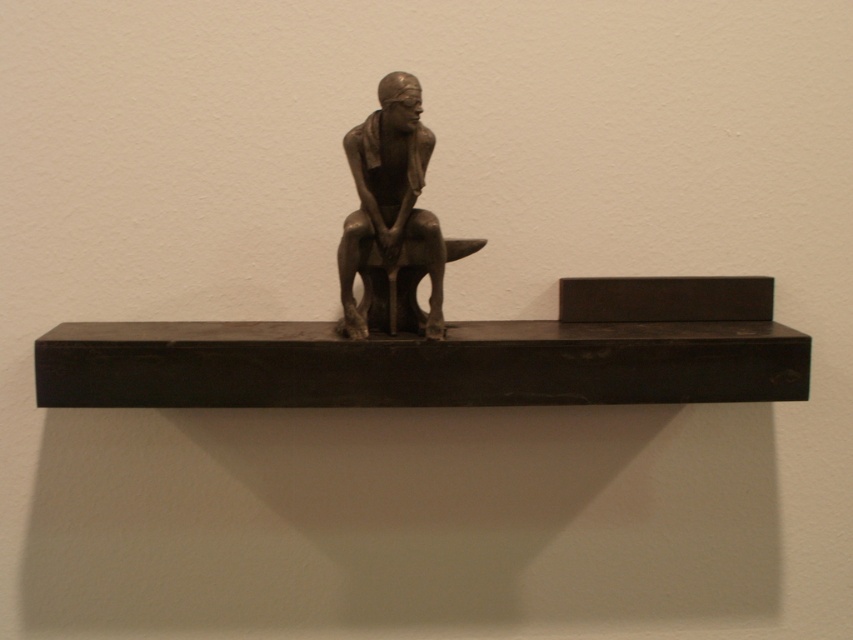
Can you confirm if black wood shelf at center is positioned below bronze statue at center?

Indeed, black wood shelf at center is positioned under bronze statue at center.

Can you confirm if black wood shelf at center is smaller than bronze statue at center?

Actually, black wood shelf at center might be larger than bronze statue at center.

Is point (267, 362) less distant than point (384, 172)?

Yes, it is.

Image resolution: width=853 pixels, height=640 pixels. Find the location of `black wood shelf at center`. black wood shelf at center is located at coordinates (416, 364).